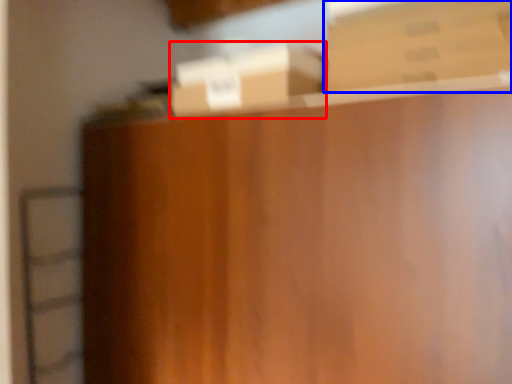
Question: Among these objects, which one is farthest to the camera, box (highlighted by a red box) or box (highlighted by a blue box)?

Choices:
 (A) box
 (B) box

Answer: (A)